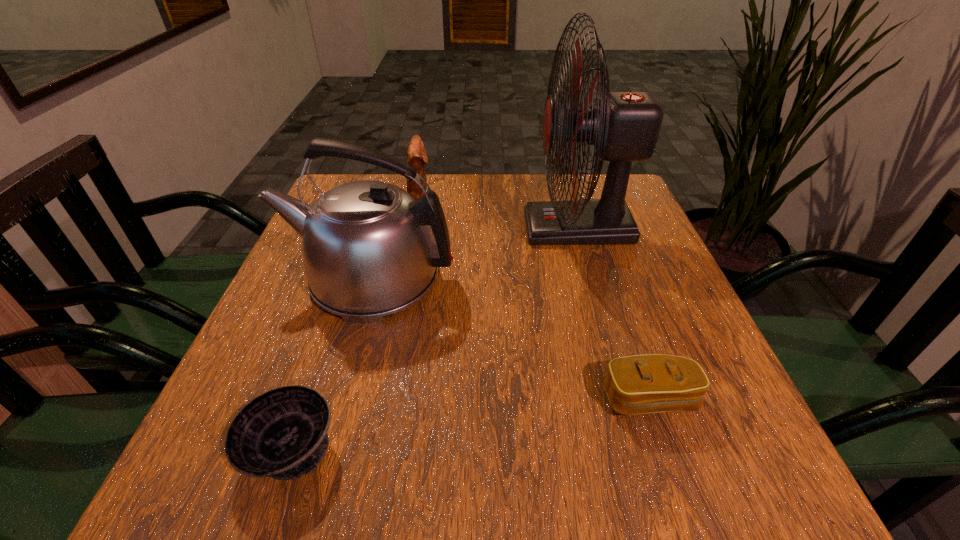
You are a GUI agent. You are given a task and a screenshot of the screen. Output one action in this format:
    pyautogui.click(x=<x>, y=<y>)
    Task: Click on the vacant space situated on the open side of the third shortest object
    This screenshot has height=540, width=960.
    Given the screenshot: What is the action you would take?
    pyautogui.click(x=534, y=193)

Where is `blank space located on the zipper side of the shorter clutch bag`? blank space located on the zipper side of the shorter clutch bag is located at coordinates (670, 460).

I want to click on free space located on the right of the bowl, so click(x=434, y=450).

At what (x,y) coordinates should I click in order to perform the action: click on fan located in the far edge section of the desktop. Please return your answer as a coordinate pair (x, y). The image size is (960, 540). Looking at the image, I should click on (624, 126).

Identify the location of clutch bag that is at the far edge. (416, 157).

You are a GUI agent. You are given a task and a screenshot of the screen. Output one action in this format:
    pyautogui.click(x=<x>, y=<y>)
    Task: Click on the object located at the near edge
    
    Given the screenshot: What is the action you would take?
    pyautogui.click(x=282, y=433)

Identify the location of kettle that is at the left edge. (370, 249).

At what (x,y) coordinates should I click in order to perform the action: click on bowl at the left edge. Please return your answer as a coordinate pair (x, y). The image size is (960, 540). Looking at the image, I should click on (282, 433).

You are a GUI agent. You are given a task and a screenshot of the screen. Output one action in this format:
    pyautogui.click(x=<x>, y=<y>)
    Task: Click on the fan that is positioned at the right edge
    The image size is (960, 540).
    Given the screenshot: What is the action you would take?
    pyautogui.click(x=624, y=126)

At what (x,y) coordinates should I click in order to perform the action: click on clutch bag that is at the right edge. Please return your answer as a coordinate pair (x, y). Looking at the image, I should click on (640, 384).